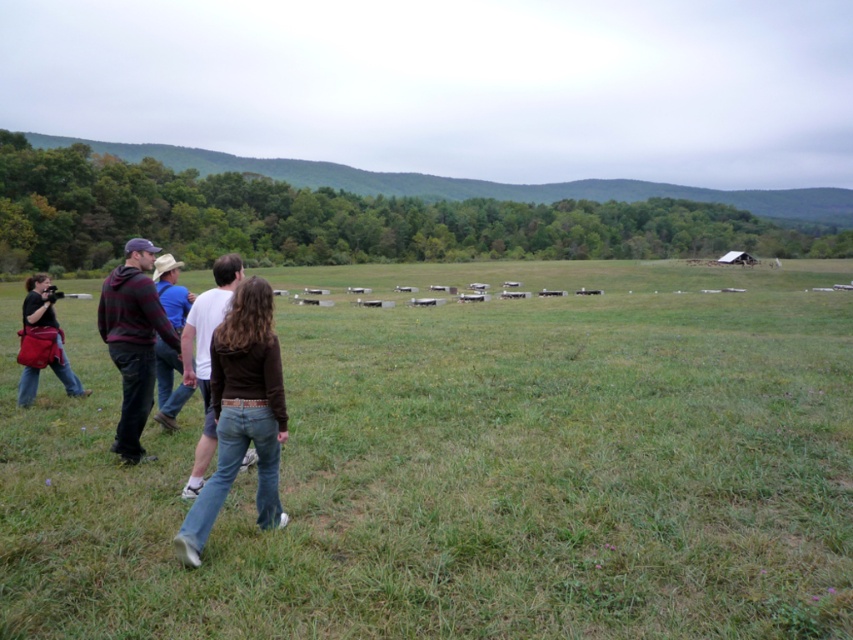
In the scene shown: You are a hiker who wants to take a photo of the plaid wool sweater at left and the green grass pasture at center. Which object should you focus on first if you want both to be in clear focus?

The plaid wool sweater at left is closer to the camera than the green grass pasture at center, so you should focus on the plaid wool sweater at left first to ensure both are in focus.

You are standing at the origin point of the coordinate system, which is the bottom left corner of the image. The image has a coordinate system where the bottom left corner is the origin point. The camera is at position 0.534, 0.050. If you want to walk towards the matte black camera at left, in which direction should you move? Please answer with a direction like north, south, east, or west.

The matte black camera at left is located at coordinates (42, 340). Since the origin is the bottom left corner, moving towards the camera would require moving east because the x coordinate increases to the right and the y coordinate remains low, indicating it is to the east direction.

You are a photographer trying to capture a photo of the forest in the background. You have a matte black camera at left and denim jeans at left in your view. Which object is shorter and should be avoided to prevent blocking the view of the forest?

The matte black camera at left has a lesser height compared to denim jeans at left, so the matte black camera at left is shorter and less likely to block the view of the forest. However, since both are on the left, you might need to adjust your position to ensure neither obstructs the forest view.